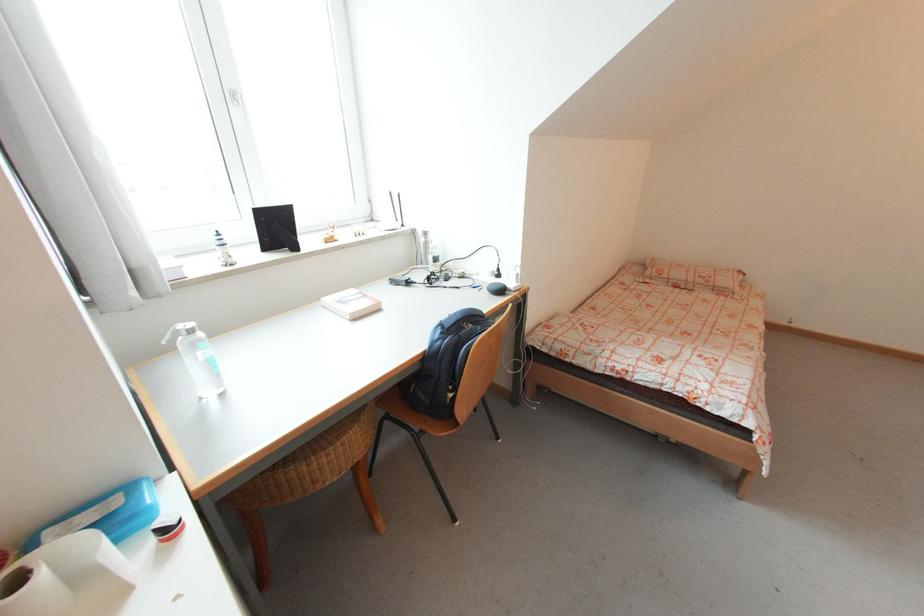
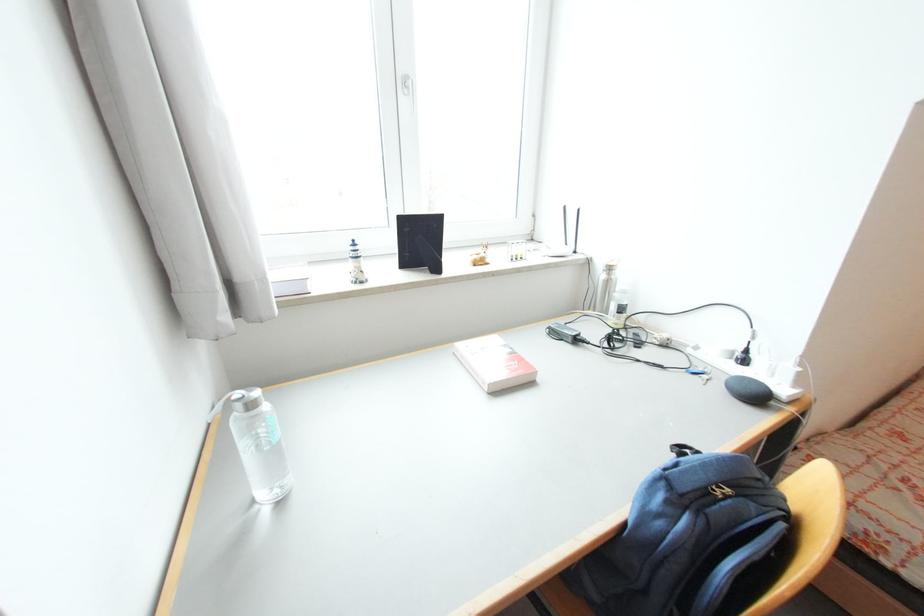
Where in the second image is the point corresponding to the point at 429,232 from the first image?

(614, 265)